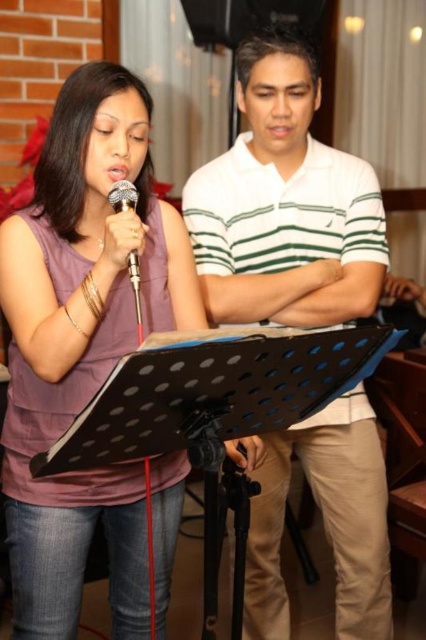
Question: Can you confirm if matte purple shirt at center is bigger than metallic silver microphone at center?

Choices:
 (A) no
 (B) yes

Answer: (B)

Question: Among these points, which one is nearest to the camera?

Choices:
 (A) (69, 224)
 (B) (129, 266)

Answer: (B)

Question: Which object appears farthest from the camera in this image?

Choices:
 (A) white striped polo shirt at center
 (B) matte purple shirt at center
 (C) metallic silver microphone at center

Answer: (A)

Question: Which is farther from the white striped polo shirt at center?

Choices:
 (A) matte purple shirt at center
 (B) metallic silver microphone at center

Answer: (B)

Question: Where is matte purple shirt at center located in relation to white striped polo shirt at center in the image?

Choices:
 (A) right
 (B) left

Answer: (B)

Question: Is matte purple shirt at center below white striped polo shirt at center?

Choices:
 (A) no
 (B) yes

Answer: (B)